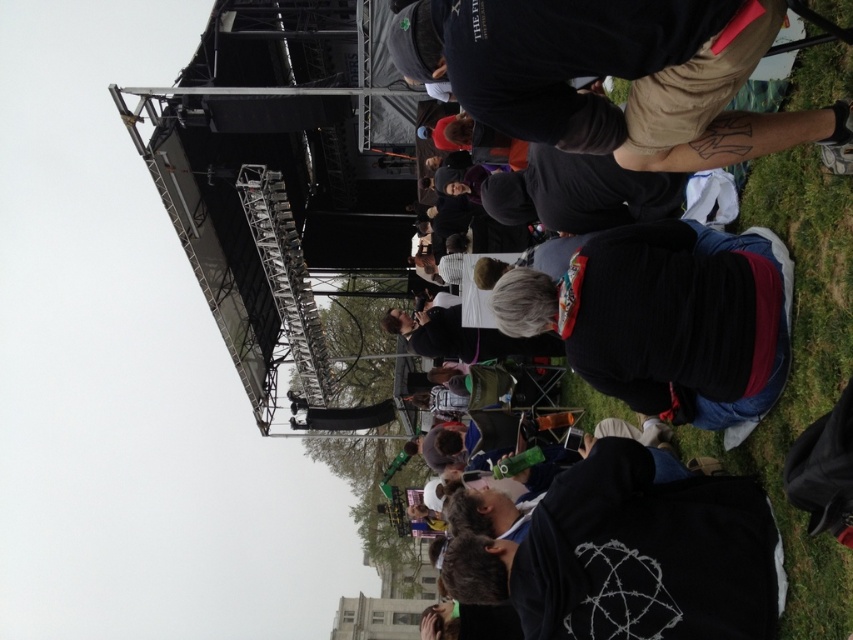
You are a stagehand who needs to move a 10 meter long extension cord from the black knit sweater at center to the black fabric at center. Can you place the cord between them without needing to cut it?

The distance between the black knit sweater at center and the black fabric at center is 8.49 meters. Since the extension cord is 10 meters long, it is longer than the required distance, so yes, you can place the cord between them without needing to cut it.

You are a photographer at the event and want to capture a photo that includes both the black matte jacket at lower right and the black fabric at center. Since both are black, you need to ensure they are distinguishable in the photo. Based on their positions, which object should you focus on first to ensure both are in the frame?

The black matte jacket at lower right is positioned on the right side of black fabric at center. To ensure both are in the frame, focus on the black fabric at center first, then adjust the camera to include the black matte jacket at lower right on its right side.

Based on the photo, you are standing at the camera position and want to throw a small ball to hit either the point at (746, 272) or the point at (479, 300). Which point is closer to you?

The point at (746, 272) is closer to the camera than the point at (479, 300), so you should aim for that point to hit it more easily.